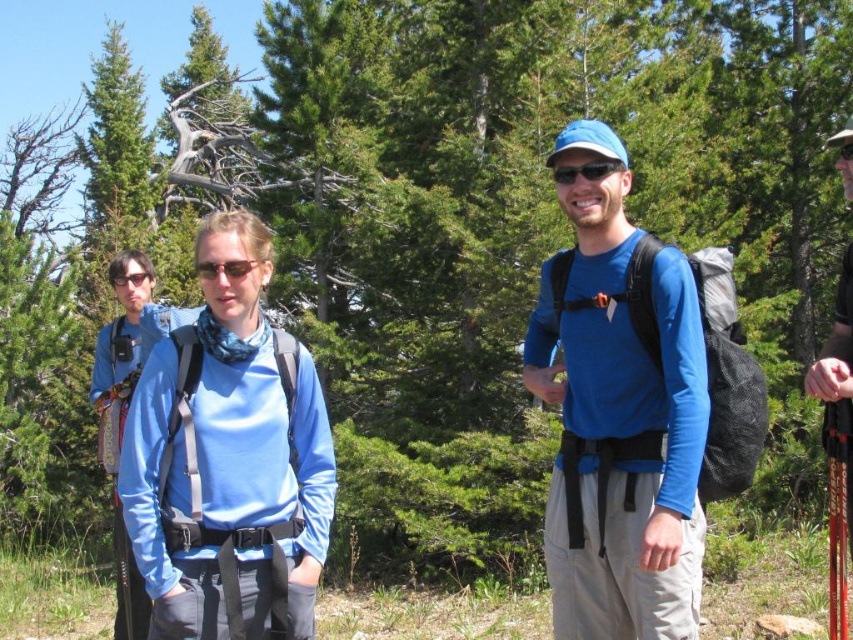
Is point (302, 355) positioned after point (827, 141)?

No, (302, 355) is closer to viewer.

This screenshot has width=853, height=640. Identify the location of matte blue shirt at center. (227, 460).

At what (x,y) coordinates should I click in order to perform the action: click on matte blue shirt at center. Please return your answer as a coordinate pair (x, y). This screenshot has width=853, height=640. Looking at the image, I should click on (227, 460).

Does matte blue shirt at center have a larger size compared to black matte sunglasses at center?

Indeed, matte blue shirt at center has a larger size compared to black matte sunglasses at center.

Measure the distance between point (277, 458) and camera.

Point (277, 458) is 4.63 meters from camera.

Locate an element on the screen. This screenshot has width=853, height=640. matte blue shirt at center is located at coordinates (227, 460).

Is point (579, 214) behind point (213, 433)?

Yes, it is behind point (213, 433).

Which is more to the right, blue fabric shirt at center or matte blue shirt at center?

blue fabric shirt at center

I want to click on blue fabric shirt at center, so (x=619, y=419).